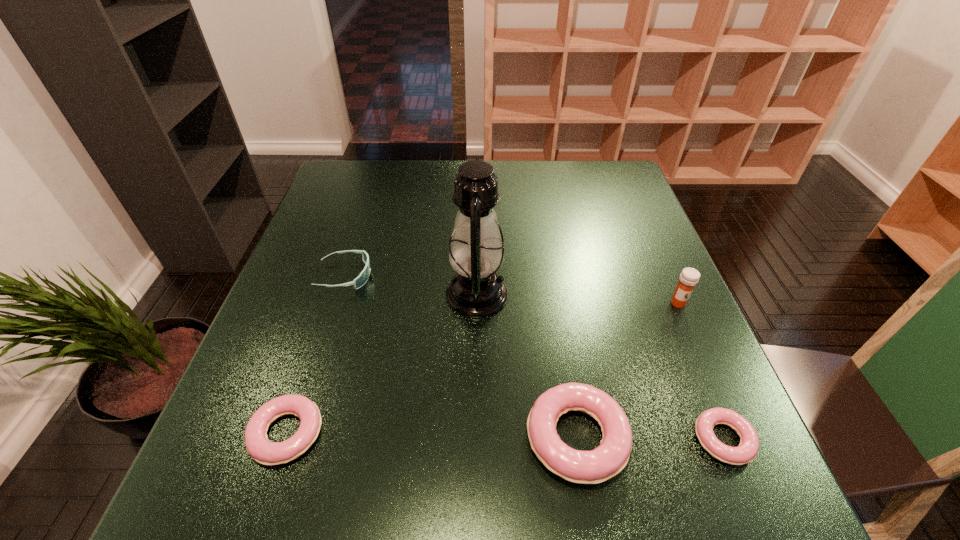
Choose which doughnut is the third nearest neighbor to the tallest object. Please provide its 2D coordinates. Your answer should be formatted as a tuple, i.e. [(x, y)], where the tuple contains the x and y coordinates of a point satisfying the conditions above.

[(747, 450)]

Identify the location of doughnut object that ranks as the closest to the fifth shortest object. (747, 450).

Locate an element on the screen. blank area in the image that satisfies the following two spatial constraints: 1. on the front-facing side of the goggles; 2. on the back side of the fourth shortest object is located at coordinates (294, 437).

Find the location of `free location that satisfies the following two spatial constraints: 1. on the front side of the second tallest doughnut; 2. on the left side of the tallest doughnut`. free location that satisfies the following two spatial constraints: 1. on the front side of the second tallest doughnut; 2. on the left side of the tallest doughnut is located at coordinates (285, 437).